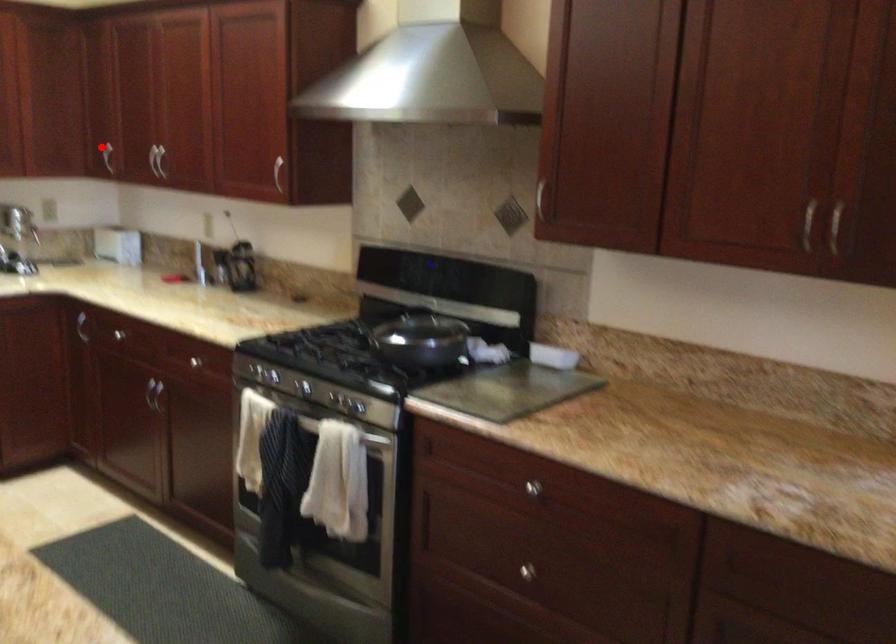
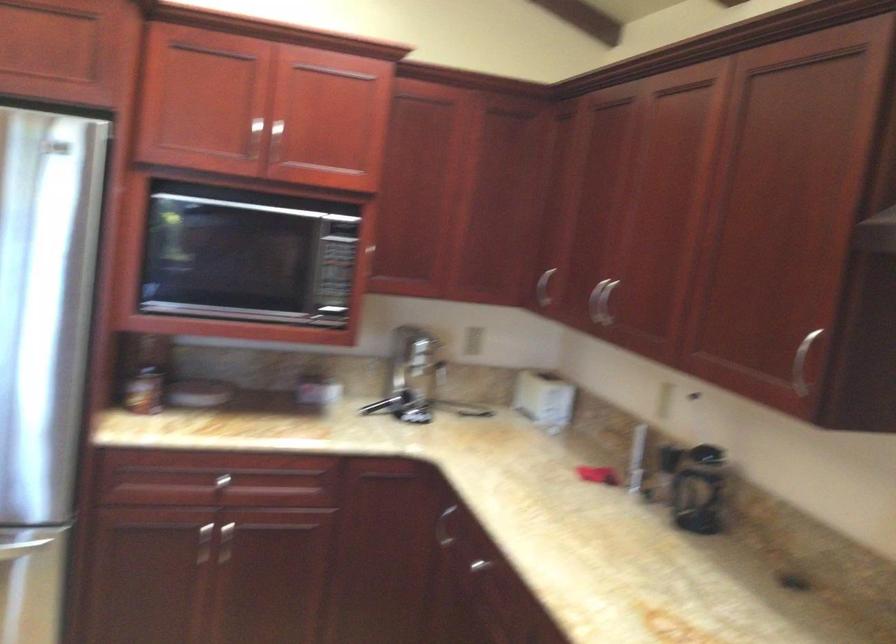
Where in the second image is the point corresponding to the highlighted location from the first image?

(544, 287)